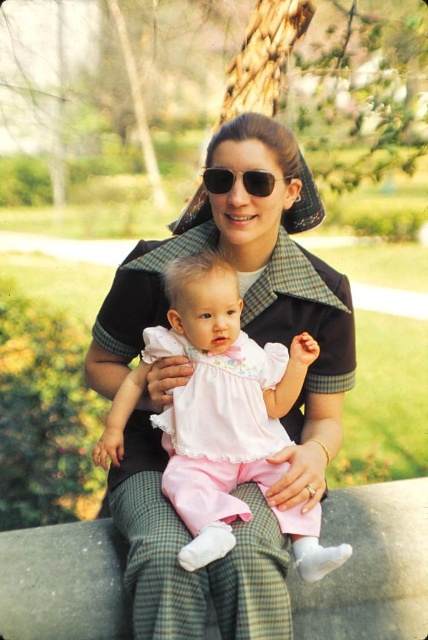
Question: Is pink satin dress at center to the left of black matte sunglasses at center from the viewer's perspective?

Choices:
 (A) no
 (B) yes

Answer: (B)

Question: Does pink satin dress at center have a greater width compared to black matte sunglasses at center?

Choices:
 (A) yes
 (B) no

Answer: (A)

Question: Considering the relative positions of pink satin dress at center and black matte sunglasses at center in the image provided, where is pink satin dress at center located with respect to black matte sunglasses at center?

Choices:
 (A) below
 (B) above

Answer: (A)

Question: Which point is closer to the camera taking this photo?

Choices:
 (A) (244, 184)
 (B) (275, 346)

Answer: (A)